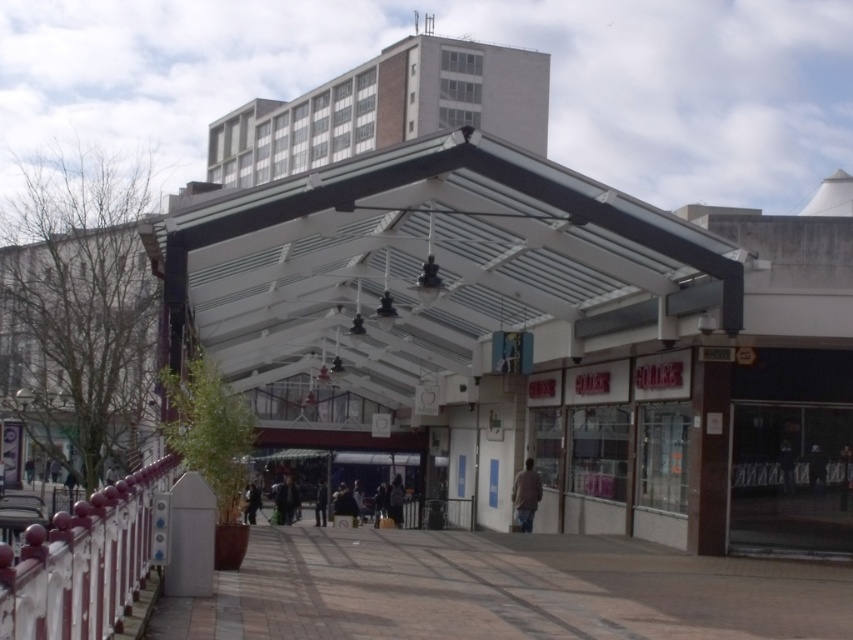
Between brown tile pavement at lower center and dark gray fabric jacket at center, which one has less height?

Standing shorter between the two is dark gray fabric jacket at center.

Is brown tile pavement at lower center thinner than dark gray fabric jacket at center?

No.

Which is in front, point (416, 577) or point (283, 502)?

Positioned in front is point (416, 577).

Identify the location of brown tile pavement at lower center. (502, 589).

Describe the element at coordinates (526, 493) in the screenshot. I see `light brown fabric jacket at center` at that location.

From the picture: Can you confirm if light brown fabric jacket at center is positioned to the left of dark gray fabric jacket at center?

Incorrect, light brown fabric jacket at center is not on the left side of dark gray fabric jacket at center.

Is point (538, 476) less distant than point (280, 518)?

That is True.

This screenshot has height=640, width=853. I want to click on light brown fabric jacket at center, so click(x=526, y=493).

Can you confirm if light brown fabric jacket at center is shorter than dark gray jacket at center?

No, light brown fabric jacket at center is not shorter than dark gray jacket at center.

Is light brown fabric jacket at center bigger than dark gray jacket at center?

Yes, light brown fabric jacket at center is bigger than dark gray jacket at center.

Is point (534, 476) farther from camera compared to point (397, 492)?

No, it is not.

Image resolution: width=853 pixels, height=640 pixels. I want to click on light brown fabric jacket at center, so click(526, 493).